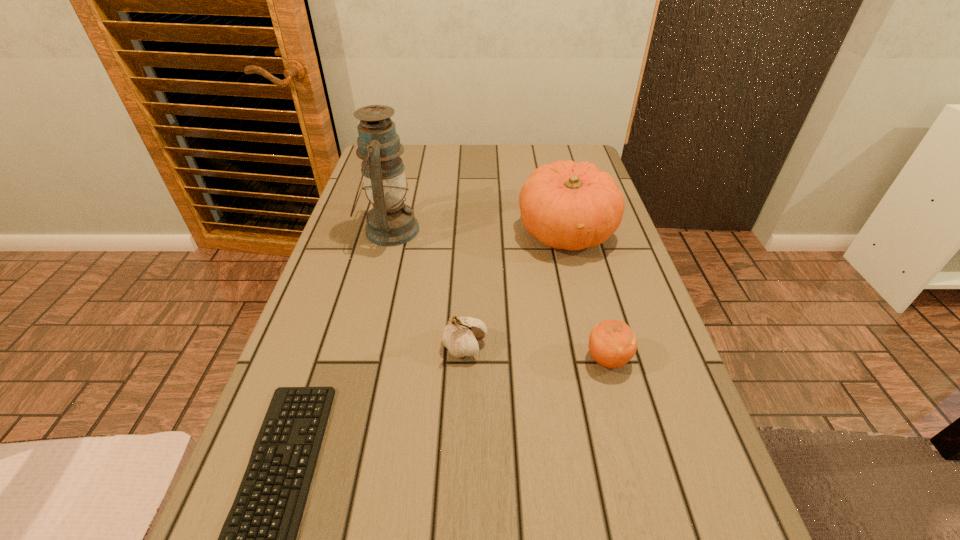
Identify the location of oil lamp. This screenshot has width=960, height=540. (390, 222).

At what (x,y) coordinates should I click in order to perform the action: click on the second tallest object. Please return your answer as a coordinate pair (x, y). The image size is (960, 540). Looking at the image, I should click on (565, 205).

You are a GUI agent. You are given a task and a screenshot of the screen. Output one action in this format:
    pyautogui.click(x=<x>, y=<y>)
    Task: Click on the third object from right to left
    The width and height of the screenshot is (960, 540).
    Given the screenshot: What is the action you would take?
    pyautogui.click(x=461, y=336)

At what (x,y) coordinates should I click in order to perform the action: click on orange. Please return your answer as a coordinate pair (x, y). Looking at the image, I should click on (612, 344).

The height and width of the screenshot is (540, 960). I want to click on vacant space located on the back of the tallest object, so click(x=405, y=169).

Where is `free space located on the back of the fourth shortest object`? free space located on the back of the fourth shortest object is located at coordinates (550, 165).

Identify the location of vacant space located 0.310m on the back of the garlic. This screenshot has height=540, width=960. (468, 241).

Where is `free space located on the left of the orange`? Image resolution: width=960 pixels, height=540 pixels. free space located on the left of the orange is located at coordinates (399, 360).

The image size is (960, 540). I want to click on object located at the left edge, so click(x=390, y=222).

The height and width of the screenshot is (540, 960). I want to click on pumpkin that is at the right edge, so click(x=565, y=205).